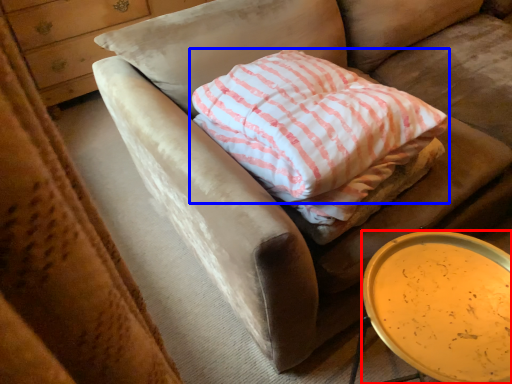
Question: Among these objects, which one is nearest to the camera, table (highlighted by a red box) or pillow (highlighted by a blue box)?

Choices:
 (A) table
 (B) pillow

Answer: (A)